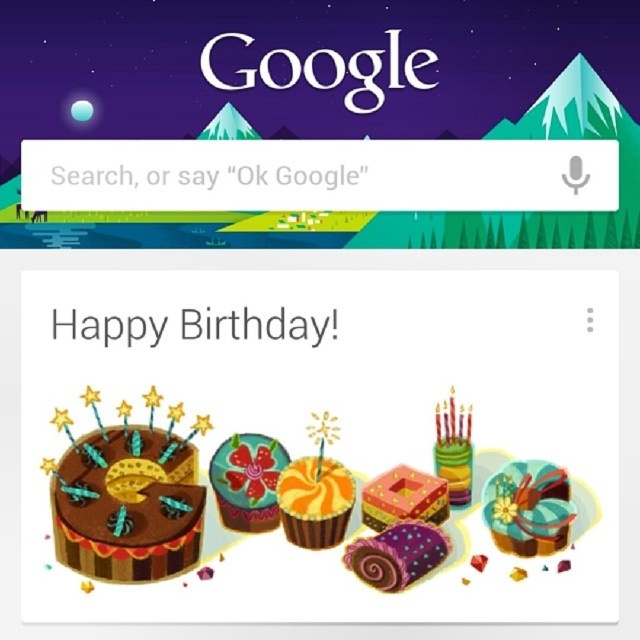
You are navigating a virtual tour of the Google birthday page. You see two points marked on the screen. The first point is at position point (x=508, y=472) and the second is at point (x=424, y=566). Which point is closer to you as you look at the page?

Point (x=508, y=472) is closer to you than point (x=424, y=566) because it is further to the viewer.

In the scene shown: You are designing a birthday card and want to place the shiny metallic cake at center right and the black paper text at center on a page that is 7 inches wide. Will the two elements fit side by side without overlapping?

The shiny metallic cake at center right and black paper text at center are 6.98 inches apart from each other, so they will fit side by side on a 7 inch wide page since the total width required is less than 7 inches.

You are designing a birthday card and want to include the shiny metallic cake at center right from the image. If the card has a coordinate system where the bottom left corner is at point 0,0 and the top right corner is at point 1,1, where should you place the cake to match its position in the image?

The shiny metallic cake at center right should be placed at point (529, 508) to match its position in the image.